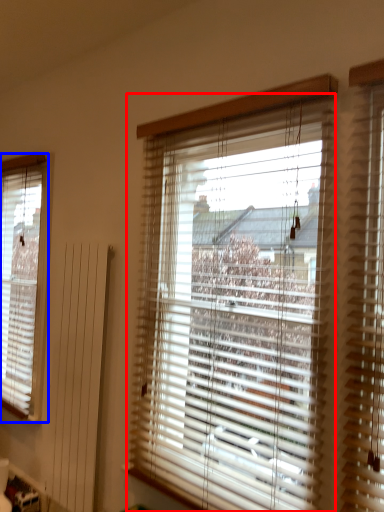
Question: Which point is further to the camera, window blind (highlighted by a red box) or window blind (highlighted by a blue box)?

Choices:
 (A) window blind
 (B) window blind

Answer: (B)